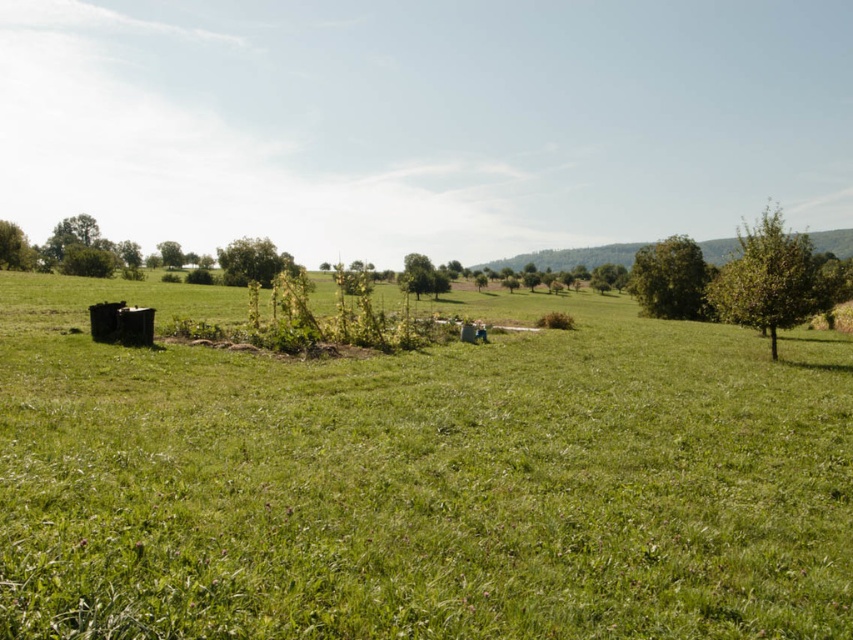
You are standing in the rural landscape and want to walk towards the green leafy tree at upper right and the green leafy tree at left. Which tree will you reach first?

You will reach the green leafy tree at upper right first because it is closer to you than the green leafy tree at left.

Consider the image. You are standing in the rural landscape and want to walk from the green leafy tree at left to the green grass pasture at center. Which direction should you move relative to the tree?

You should move downward from the green leafy tree at left to reach the green grass pasture at center since the pasture is located below the tree.